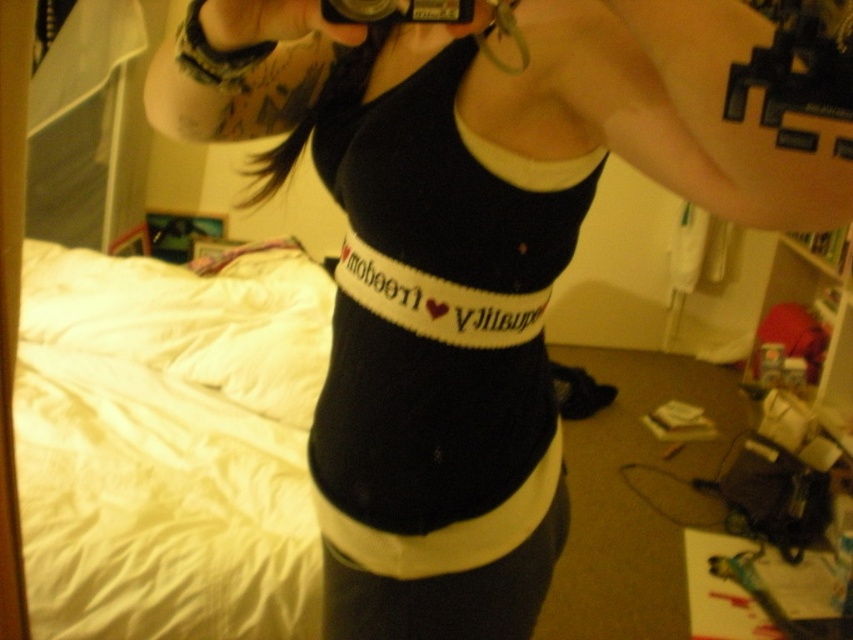
You are organizing a photo shoot and need to ensure that the black plastic camera at upper center is visible in the frame. Given that the white cotton bed at left is in the background, how might its size affect the camera visibility?

The white cotton bed at left is larger than the black plastic camera at upper center, so it may overshadow the camera in the frame, making it harder to see.

You are trying to take a photo of the black knitted belt at center and the black plastic camera at upper center. Which object should you focus on first if you want to capture both in focus?

The black plastic camera at upper center is behind the black knitted belt at center, so you should focus on the black knitted belt at center first to ensure both objects are in focus.

You are a photographer trying to capture the black knitted belt at center in your shot. Since the white cotton bed at left is blocking your view, can you move around to the right side of the bed to get a clear shot of the belt?

The black knitted belt at center is behind the white cotton bed at left, so moving to the right side of the bed might allow you to see around the bed and capture the belt.